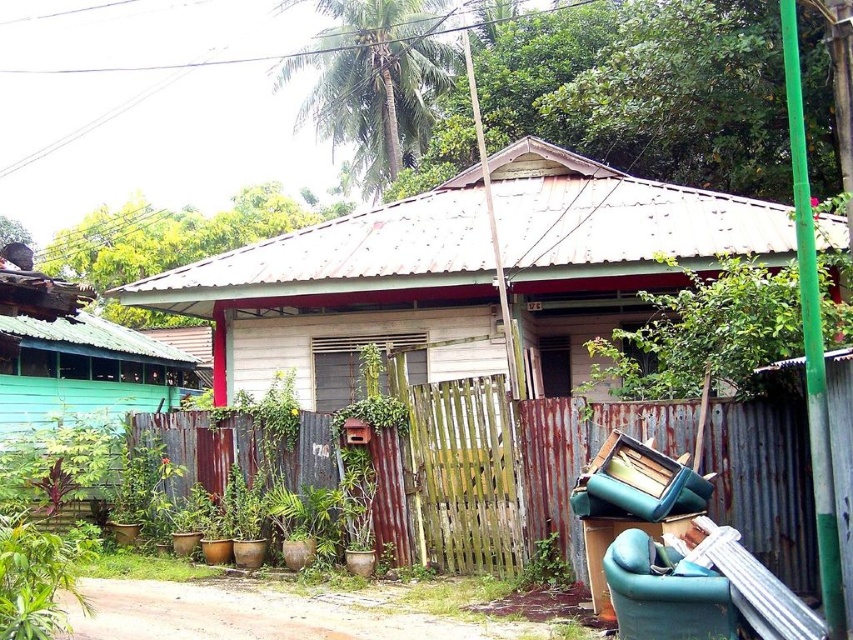
You are a delivery person trying to deliver a package to the wooden hut at center. You notice there is a rusty metal fence at center blocking your path. Can you walk through the fence to reach the hut?

The wooden hut at center is not as tall as the rusty metal fence at center, so the fence is taller than the hut. However, fences typically block passage, so you cannot walk through the rusty metal fence at center to reach the wooden hut at center.

You are planning to move a large piece of furniture that is 1.5 meters wide through the narrowest point between the wooden hut at center and the green fabric armchair at lower right. Based on the scene description, will the furniture fit through that space?

The wooden hut at center is thinner than the green fabric armchair at lower right, so the narrowest point between them would be where the wooden hut at center is located. Since the furniture is 1.5 meters wide and the wooden hut at center is thinner, it is possible that the space might be narrower than 1.5 meters. However, without exact measurements, we cannot be certain. The answer depends on how much thinner the wooden hut at center is compared to the green fabric armchair at lower right.